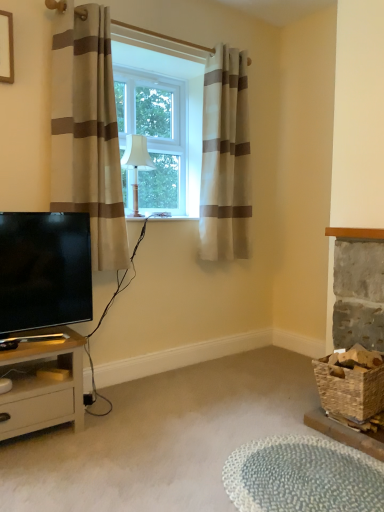
Question: From a real-world perspective, is beige striped curtain at center, placed as the 2th curtain when sorted from front to back, positioned under textured gray rug at lower center based on gravity?

Choices:
 (A) no
 (B) yes

Answer: (A)

Question: Is beige striped curtain at center, placed as the 2th curtain when sorted from front to back, at the left side of textured gray rug at lower center?

Choices:
 (A) yes
 (B) no

Answer: (A)

Question: Is beige striped curtain at center, which is the first curtain from back to front, to the right of textured gray rug at lower center from the viewer's perspective?

Choices:
 (A) yes
 (B) no

Answer: (B)

Question: Is beige striped curtain at center, which is counted as the 1th curtain, starting from the right, positioned with its back to textured gray rug at lower center?

Choices:
 (A) no
 (B) yes

Answer: (A)

Question: Is beige striped curtain at center, which is counted as the 1th curtain, starting from the right, completely or partially outside of textured gray rug at lower center?

Choices:
 (A) no
 (B) yes

Answer: (B)

Question: In terms of width, does light beige wood nightstand at lower left look wider or thinner when compared to textured gray rug at lower center?

Choices:
 (A) wide
 (B) thin

Answer: (B)

Question: Based on their sizes in the image, would you say light beige wood nightstand at lower left is bigger or smaller than textured gray rug at lower center?

Choices:
 (A) big
 (B) small

Answer: (A)

Question: From a real-world perspective, relative to textured gray rug at lower center, is light beige wood nightstand at lower left vertically above or below?

Choices:
 (A) above
 (B) below

Answer: (A)

Question: Considering their positions, is light beige wood nightstand at lower left located in front of or behind textured gray rug at lower center?

Choices:
 (A) behind
 (B) front

Answer: (A)

Question: In terms of size, does wooden picture frame at upper left appear bigger or smaller than beige striped curtain at center, which is the first curtain from back to front?

Choices:
 (A) big
 (B) small

Answer: (B)

Question: Is point (4, 28) positioned closer to the camera than point (246, 182)?

Choices:
 (A) closer
 (B) farther

Answer: (A)

Question: Relative to beige striped curtain at center, which ranks as the second curtain in left-to-right order, is wooden picture frame at upper left in front or behind?

Choices:
 (A) behind
 (B) front

Answer: (B)

Question: Considering the positions of wooden picture frame at upper left and beige striped curtain at center, which is counted as the 1th curtain, starting from the right, in the image, is wooden picture frame at upper left taller or shorter than beige striped curtain at center, which is counted as the 1th curtain, starting from the right,?

Choices:
 (A) tall
 (B) short

Answer: (B)

Question: Would you say textured gray rug at lower center is to the left or to the right of light beige wood nightstand at lower left in the picture?

Choices:
 (A) right
 (B) left

Answer: (A)

Question: From their relative heights in the image, would you say textured gray rug at lower center is taller or shorter than light beige wood nightstand at lower left?

Choices:
 (A) short
 (B) tall

Answer: (A)